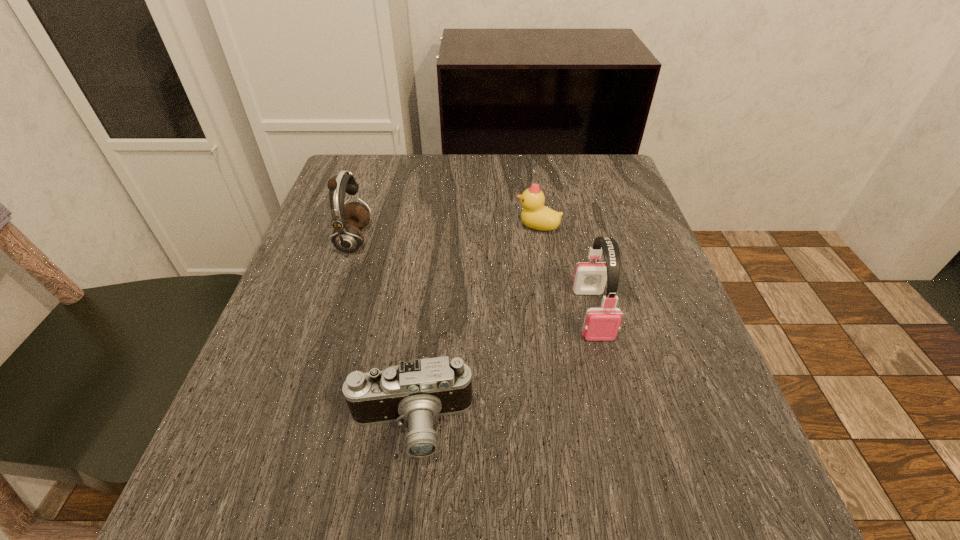
Locate an element on the screen. This screenshot has height=540, width=960. blank area at the far right corner is located at coordinates (565, 154).

You are a GUI agent. You are given a task and a screenshot of the screen. Output one action in this format:
    pyautogui.click(x=<x>, y=<y>)
    Task: Click on the free space between the farther earphone and the second nearest object
    Image resolution: width=960 pixels, height=540 pixels.
    Given the screenshot: What is the action you would take?
    pyautogui.click(x=473, y=277)

You are a GUI agent. You are given a task and a screenshot of the screen. Output one action in this format:
    pyautogui.click(x=<x>, y=<y>)
    Task: Click on the free space between the right earphone and the duckling
    
    Given the screenshot: What is the action you would take?
    pyautogui.click(x=564, y=270)

Locate an element on the screen. The height and width of the screenshot is (540, 960). blank region between the duckling and the camera is located at coordinates (474, 326).

Where is `unoccupied position between the farther earphone and the nearer earphone`? This screenshot has width=960, height=540. unoccupied position between the farther earphone and the nearer earphone is located at coordinates (473, 277).

You are a GUI agent. You are given a task and a screenshot of the screen. Output one action in this format:
    pyautogui.click(x=<x>, y=<y>)
    Task: Click on the vacant space that is in between the farther earphone and the duckling
    The image size is (960, 540).
    Given the screenshot: What is the action you would take?
    pyautogui.click(x=445, y=233)

Image resolution: width=960 pixels, height=540 pixels. Find the location of `empty space between the nearest object and the leftmost object`. empty space between the nearest object and the leftmost object is located at coordinates (382, 333).

I want to click on empty space that is in between the left earphone and the duckling, so click(x=445, y=233).

This screenshot has height=540, width=960. I want to click on empty space between the left earphone and the duckling, so click(445, 233).

Find the location of a particular element. This screenshot has width=960, height=540. free spot between the duckling and the second nearest object is located at coordinates (564, 270).